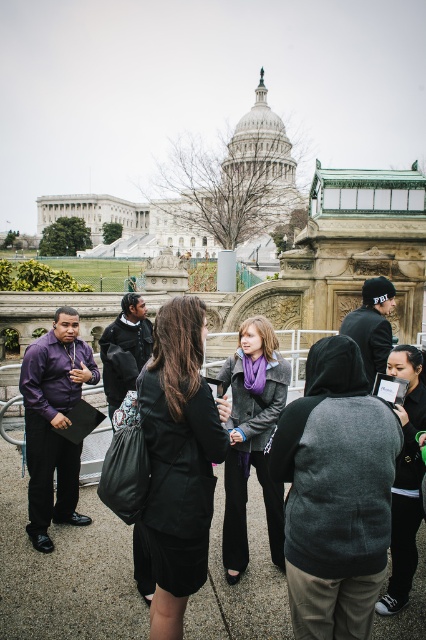
Question: Is black fabric coat at center wider than matte gray jacket at center?

Choices:
 (A) yes
 (B) no

Answer: (A)

Question: Which of the following is the farthest from the observer?

Choices:
 (A) (189, 324)
 (B) (245, 378)
 (C) (394, 484)

Answer: (B)

Question: Among these objects, which one is farthest from the camera?

Choices:
 (A) black fabric coat at center
 (B) matte gray jacket at center

Answer: (B)

Question: Which of the following is the farthest from the observer?

Choices:
 (A) dark gray hoodie at center
 (B) matte gray jacket at center

Answer: (B)

Question: Can you confirm if black fabric coat at center is thinner than dark gray hoodie at center?

Choices:
 (A) yes
 (B) no

Answer: (B)

Question: From the image, what is the correct spatial relationship of matte gray jacket at center in relation to dark gray hoodie at center?

Choices:
 (A) left
 (B) right

Answer: (A)